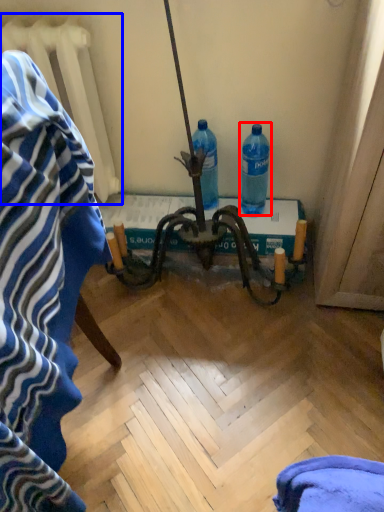
Question: Which object appears farthest to the camera in this image, bottle (highlighted by a red box) or radiator (highlighted by a blue box)?

Choices:
 (A) bottle
 (B) radiator

Answer: (A)